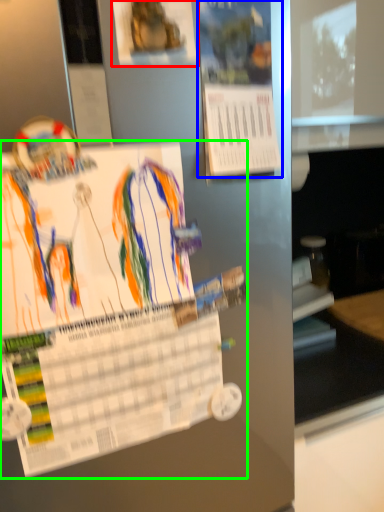
Question: Which is nearer to the poster (highlighted by a red box)? poster (highlighted by a blue box) or poster (highlighted by a green box).

Choices:
 (A) poster
 (B) poster

Answer: (A)